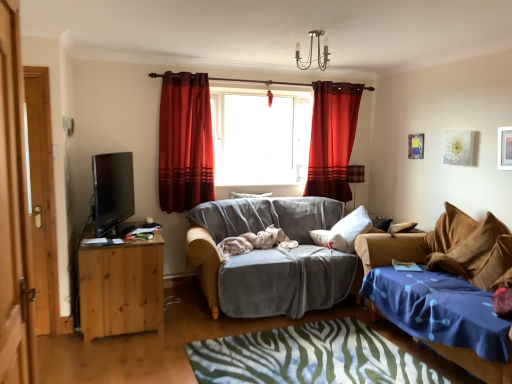
Identify the location of vacant area that is in front of pine wood desk at left. The width and height of the screenshot is (512, 384). (112, 353).